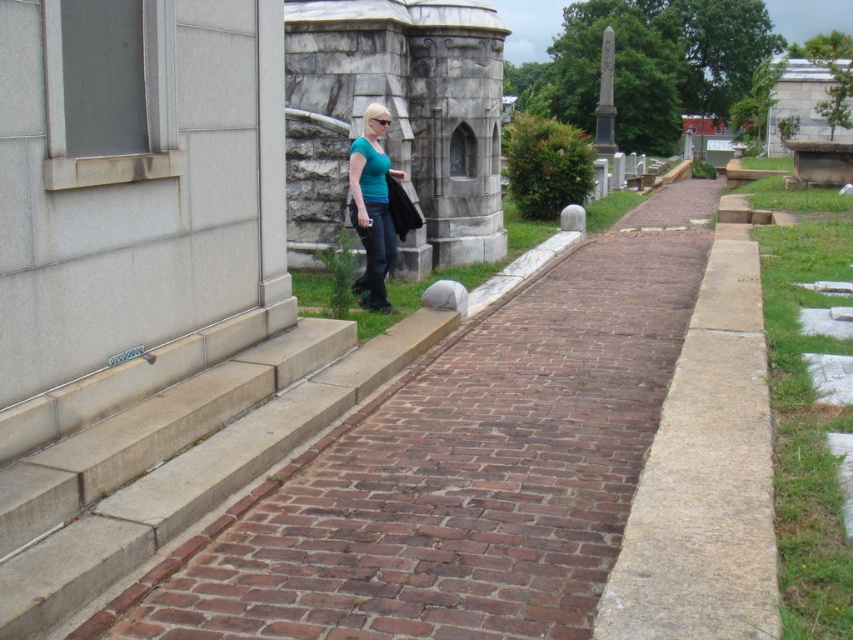
You are standing at the entrance of the cemetery and see the brick pavement at center and the black marble obelisk at upper right. Which object is taller?

The black marble obelisk at upper right is taller than the brick pavement at center.

You are standing at the point labeled point (372, 205) in the image. What object are you touching?

The point (372, 205) is on the matte teal shirt at center, so you are touching the matte teal shirt at center.

You are a visitor at the cemetery and want to take a photo of both the matte teal shirt at center and the black marble obelisk at upper right. Which object should you focus on first to ensure both are in frame?

You should focus on the black marble obelisk at upper right first because it is taller than the matte teal shirt at center, so positioning the camera to include its full height will naturally include the shorter object in the frame.